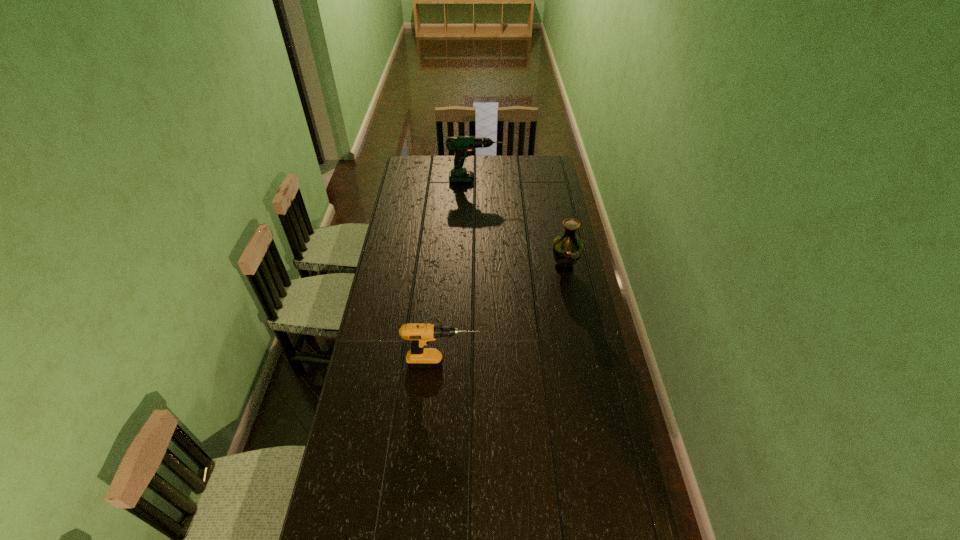
Locate an element on the screen. object that is the second closest to the farthest object is located at coordinates (420, 334).

Where is `free spot that satisfies the following two spatial constraints: 1. on the front side of the rightmost object; 2. at the tip of the shorter drill`? The height and width of the screenshot is (540, 960). free spot that satisfies the following two spatial constraints: 1. on the front side of the rightmost object; 2. at the tip of the shorter drill is located at coordinates (583, 363).

Where is `free spot that satisfies the following two spatial constraints: 1. on the handle side of the taller drill; 2. on the back side of the rightmost object`? This screenshot has width=960, height=540. free spot that satisfies the following two spatial constraints: 1. on the handle side of the taller drill; 2. on the back side of the rightmost object is located at coordinates (474, 268).